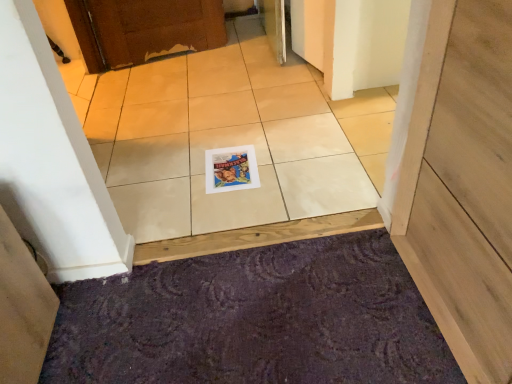
At what (x,y) coordinates should I click in order to perform the action: click on free space above purple textured doormat at lower center (from a real-world perspective). Please return your answer as a coordinate pair (x, y). This screenshot has width=512, height=384. Looking at the image, I should click on (251, 331).